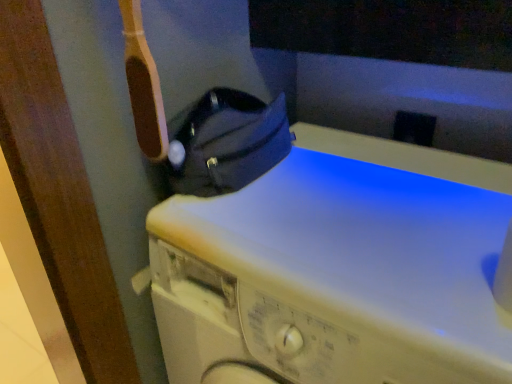
Image resolution: width=512 pixels, height=384 pixels. Describe the element at coordinates (340, 269) in the screenshot. I see `white matte washing machine at center` at that location.

Locate an element on the screen. white matte washing machine at center is located at coordinates (340, 269).

What do you see at coordinates (227, 143) in the screenshot?
I see `black leather bag at upper left` at bounding box center [227, 143].

The width and height of the screenshot is (512, 384). I want to click on black leather bag at upper left, so [227, 143].

At what (x,y) coordinates should I click in order to perform the action: click on white matte washing machine at center. Please return your answer as a coordinate pair (x, y). The height and width of the screenshot is (384, 512). Looking at the image, I should click on (340, 269).

Is black leather bag at upper left at the left side of white matte washing machine at center?

Yes, black leather bag at upper left is to the left of white matte washing machine at center.

Is the position of black leather bag at upper left less distant than that of white matte washing machine at center?

No, it is behind white matte washing machine at center.

Does point (193, 160) come in front of point (433, 301)?

No.

From the image's perspective, between black leather bag at upper left and white matte washing machine at center, who is located below?

From the image's view, white matte washing machine at center is below.

From a real-world perspective, is black leather bag at upper left located higher than white matte washing machine at center?

Yes, from a real-world perspective, black leather bag at upper left is on top of white matte washing machine at center.

Which object is thinner, black leather bag at upper left or white matte washing machine at center?

Thinner between the two is black leather bag at upper left.

Can you confirm if black leather bag at upper left is taller than white matte washing machine at center?

No, black leather bag at upper left is not taller than white matte washing machine at center.

Considering the sizes of black leather bag at upper left and white matte washing machine at center in the image, is black leather bag at upper left bigger or smaller than white matte washing machine at center?

black leather bag at upper left is smaller than white matte washing machine at center.

Would you say black leather bag at upper left is outside white matte washing machine at center?

Indeed, black leather bag at upper left is completely outside white matte washing machine at center.

Can you see black leather bag at upper left touching white matte washing machine at center?

No, black leather bag at upper left is not with white matte washing machine at center.

Could you tell me if black leather bag at upper left is turned towards white matte washing machine at center?

No.

Can you tell me how much black leather bag at upper left and white matte washing machine at center differ in facing direction?

The angular difference between black leather bag at upper left and white matte washing machine at center is 90 degrees.

How much distance is there between black leather bag at upper left and white matte washing machine at center?

They are 7.41 inches apart.

You are a GUI agent. You are given a task and a screenshot of the screen. Output one action in this format:
    pyautogui.click(x=<x>, y=<y>)
    Task: Click on the washing machine below the black leather bag at upper left (from a real-world perspective)
    This screenshot has height=384, width=512.
    Given the screenshot: What is the action you would take?
    pyautogui.click(x=340, y=269)

In the image, is white matte washing machine at center on the left side or the right side of black leather bag at upper left?

white matte washing machine at center is positioned on black leather bag at upper left's right side.

Is white matte washing machine at center positioned behind black leather bag at upper left?

No, it is not.

Does point (226, 349) appear closer or farther from the camera than point (180, 153)?

Point (226, 349) is positioned closer to the camera compared to point (180, 153).

From the image's perspective, who appears lower, white matte washing machine at center or black leather bag at upper left?

white matte washing machine at center, from the image's perspective.

From a real-world perspective, is white matte washing machine at center beneath black leather bag at upper left?

Yes, from a real-world perspective, white matte washing machine at center is beneath black leather bag at upper left.

Which object is wider, white matte washing machine at center or black leather bag at upper left?

With larger width is white matte washing machine at center.

Does white matte washing machine at center have a lesser height compared to black leather bag at upper left?

Incorrect, the height of white matte washing machine at center does not fall short of that of black leather bag at upper left.

Looking at the image, does white matte washing machine at center seem bigger or smaller compared to black leather bag at upper left?

Considering their sizes, white matte washing machine at center takes up more space than black leather bag at upper left.

Is black leather bag at upper left surrounded by white matte washing machine at center?

No, black leather bag at upper left is located outside of white matte washing machine at center.

Is there a large distance between white matte washing machine at center and black leather bag at upper left?

No, white matte washing machine at center is in close proximity to black leather bag at upper left.

Is white matte washing machine at center oriented towards black leather bag at upper left?

No, white matte washing machine at center is not turned towards black leather bag at upper left.

How different are the orientations of white matte washing machine at center and black leather bag at upper left in degrees?

The angular difference between white matte washing machine at center and black leather bag at upper left is 90 degrees.

How distant is white matte washing machine at center from black leather bag at upper left?

They are 18.83 centimeters apart.

Image resolution: width=512 pixels, height=384 pixels. Find the location of `washing machine located in front of the black leather bag at upper left`. washing machine located in front of the black leather bag at upper left is located at coordinates (340, 269).

At what (x,y) coordinates should I click in order to perform the action: click on washing machine in front of the black leather bag at upper left. Please return your answer as a coordinate pair (x, y). The width and height of the screenshot is (512, 384). Looking at the image, I should click on (340, 269).

What are the coordinates of `bag that is behind the white matte washing machine at center` in the screenshot? It's located at coord(227,143).